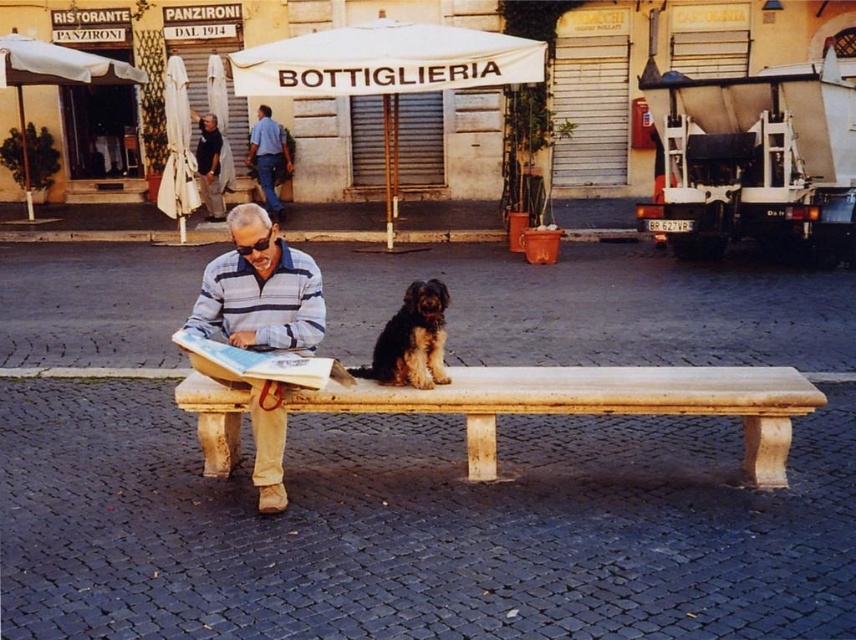
You are a photographer trying to capture a photo of the shaggy brown dog at center and the dark blue shirt at upper left in the scene. Which object takes up more area in the image?

The dark blue shirt at upper left takes up more area in the image than the shaggy brown dog at center.